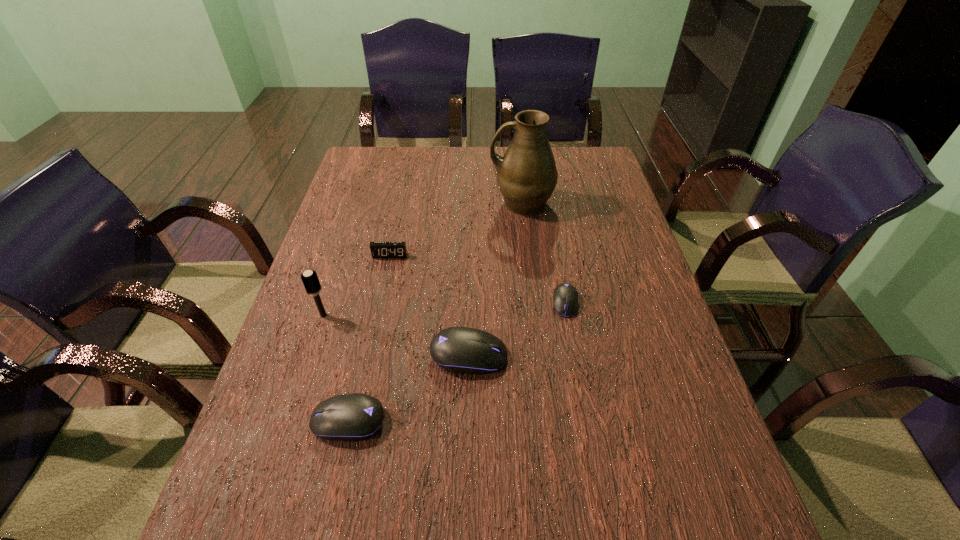
The image size is (960, 540). Identify the location of computer mouse that is at the left edge. (351, 417).

What are the coordinates of `alarm clock that is at the left edge` in the screenshot? It's located at (378, 249).

At what (x,y) coordinates should I click in order to perform the action: click on hairbrush that is at the left edge. Please return your answer as a coordinate pair (x, y). This screenshot has height=540, width=960. Looking at the image, I should click on (309, 278).

Where is `object at the near left corner`? The width and height of the screenshot is (960, 540). object at the near left corner is located at coordinates (351, 417).

Locate an element on the screen. The height and width of the screenshot is (540, 960). blank space at the far edge is located at coordinates (439, 147).

In order to click on vacant space at the near edge of the desktop in this screenshot , I will do pos(574,458).

This screenshot has height=540, width=960. In the image, there is a desktop. Find the location of `vacant space at the left edge`. vacant space at the left edge is located at coordinates tap(303, 322).

Identify the location of vacant area at the right edge of the desktop. The height and width of the screenshot is (540, 960). (570, 194).

At what (x,y) coordinates should I click in order to perform the action: click on blank space at the far left corner. Please return your answer as a coordinate pair (x, y). Looking at the image, I should click on (376, 147).

What are the coordinates of `free location at the far right corner` in the screenshot? It's located at (594, 170).